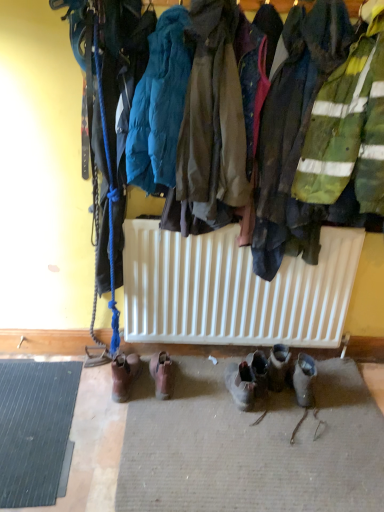
Question: From a real-world perspective, is brown fabric jacket at center, which is counted as the 1th jacket, starting from the right, below brown leather boots at center, placed as the third footwear when sorted from right to left?

Choices:
 (A) no
 (B) yes

Answer: (A)

Question: Is brown fabric jacket at center, the 2th jacket positioned from the left, bigger than brown leather boots at center, placed as the third footwear when sorted from right to left?

Choices:
 (A) no
 (B) yes

Answer: (B)

Question: From the image's perspective, is brown fabric jacket at center, the 2th jacket positioned from the left, over brown leather boots at center, placed as the third footwear when sorted from right to left?

Choices:
 (A) no
 (B) yes

Answer: (B)

Question: Is the depth of brown fabric jacket at center, the 2th jacket positioned from the left, greater than that of brown leather boots at center, positioned as the 2th footwear in left-to-right order?

Choices:
 (A) no
 (B) yes

Answer: (A)

Question: Can you confirm if brown fabric jacket at center, which is counted as the 1th jacket, starting from the right, is thinner than brown leather boots at center, positioned as the 2th footwear in left-to-right order?

Choices:
 (A) no
 (B) yes

Answer: (A)

Question: Considering the positions of brown leather boots at lower center, the 3th footwear from the left, and brown leather boots at lower center, the first footwear in the right-to-left sequence, in the image, is brown leather boots at lower center, the 3th footwear from the left, wider or thinner than brown leather boots at lower center, the first footwear in the right-to-left sequence,?

Choices:
 (A) wide
 (B) thin

Answer: (B)

Question: In the image, is brown leather boots at lower center, the 3th footwear from the left, on the left side or the right side of brown leather boots at lower center, the first footwear in the right-to-left sequence?

Choices:
 (A) right
 (B) left

Answer: (B)

Question: From the image's perspective, is brown leather boots at lower center, the 2th footwear positioned from the right, located above or below brown leather boots at lower center, the 4th footwear from the left?

Choices:
 (A) below
 (B) above

Answer: (A)

Question: From their relative heights in the image, would you say brown leather boots at lower center, the 3th footwear from the left, is taller or shorter than brown leather boots at lower center, the first footwear in the right-to-left sequence?

Choices:
 (A) tall
 (B) short

Answer: (B)

Question: From the image's perspective, is brown leather boots at lower center, the 4th footwear from the left, located above or below brown fabric jacket at center, which is counted as the 1th jacket, starting from the right?

Choices:
 (A) below
 (B) above

Answer: (A)

Question: Is brown leather boots at lower center, the first footwear in the right-to-left sequence, inside or outside of brown fabric jacket at center, which is counted as the 1th jacket, starting from the right?

Choices:
 (A) inside
 (B) outside

Answer: (B)

Question: In terms of size, does brown leather boots at lower center, the 4th footwear from the left, appear bigger or smaller than brown fabric jacket at center, which is counted as the 1th jacket, starting from the right?

Choices:
 (A) small
 (B) big

Answer: (A)

Question: From a real-world perspective, is brown leather boots at lower center, the first footwear in the right-to-left sequence, above or below brown fabric jacket at center, the 2th jacket positioned from the left?

Choices:
 (A) above
 (B) below

Answer: (B)

Question: Considering their positions, is brown leather boots at lower center, the 3th footwear from the left, located in front of or behind brown fabric jacket at center, the 2th jacket positioned from the left?

Choices:
 (A) behind
 (B) front

Answer: (A)

Question: Which is correct: brown leather boots at lower center, the 2th footwear positioned from the right, is inside brown fabric jacket at center, the 2th jacket positioned from the left, or outside of it?

Choices:
 (A) outside
 (B) inside

Answer: (A)